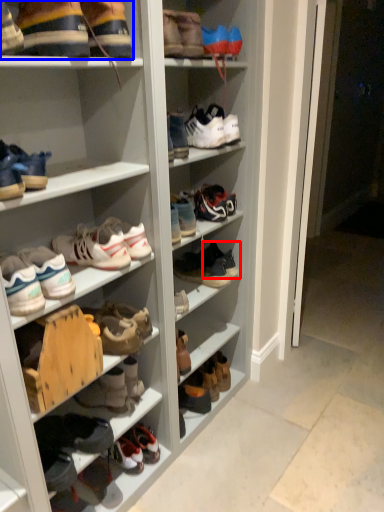
Question: Which point is closer to the camera, footwear (highlighted by a red box) or footwear (highlighted by a blue box)?

Choices:
 (A) footwear
 (B) footwear

Answer: (B)